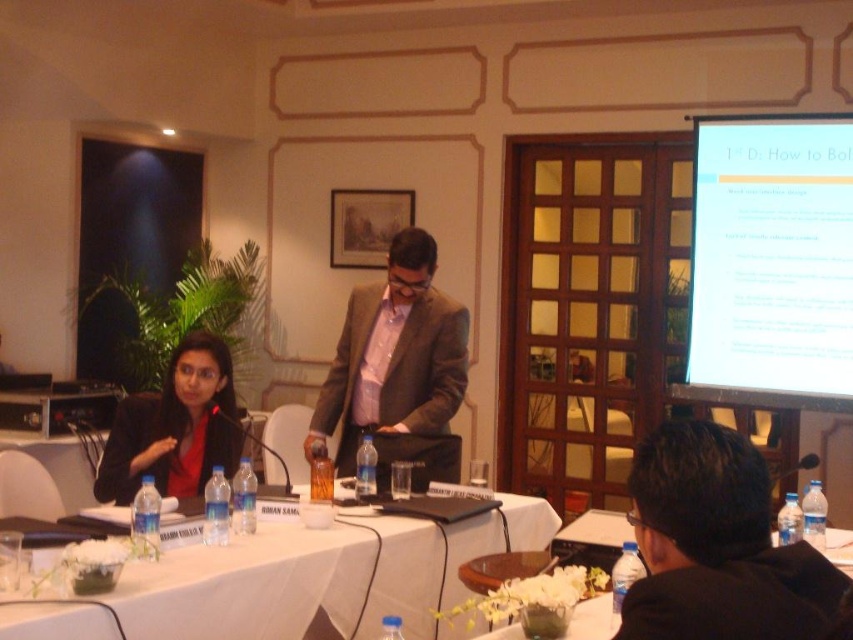
Question: Which point is closer to the camera taking this photo?

Choices:
 (A) (840, 573)
 (B) (428, 269)
 (C) (225, 582)
 (D) (122, 484)

Answer: (A)

Question: Does white glossy projection screen at upper right appear on the left side of white glossy table at lower center?

Choices:
 (A) no
 (B) yes

Answer: (A)

Question: Which object is farther from the camera taking this photo?

Choices:
 (A) white glossy table at lower center
 (B) white glossy projection screen at upper right
 (C) brown textured suit at center

Answer: (B)

Question: Does brown textured suit at center have a larger size compared to black matte jacket at left?

Choices:
 (A) no
 (B) yes

Answer: (B)

Question: Considering the relative positions of white glossy projection screen at upper right and brown textured suit at center in the image provided, where is white glossy projection screen at upper right located with respect to brown textured suit at center?

Choices:
 (A) below
 (B) above

Answer: (B)

Question: Which of these objects is positioned farthest from the black matte jacket at left?

Choices:
 (A) black suit at lower right
 (B) white cloth table at center

Answer: (A)